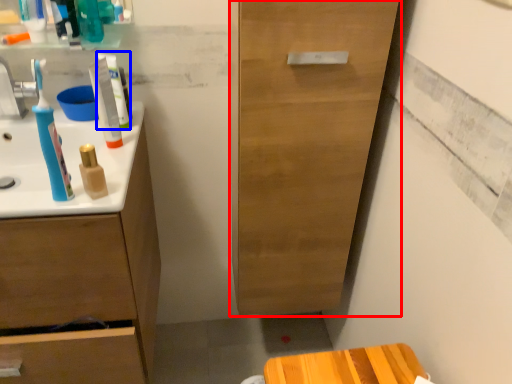
Question: Among these objects, which one is nearest to the camera, cabinetry (highlighted by a red box) or toothpaste (highlighted by a blue box)?

Choices:
 (A) cabinetry
 (B) toothpaste

Answer: (A)